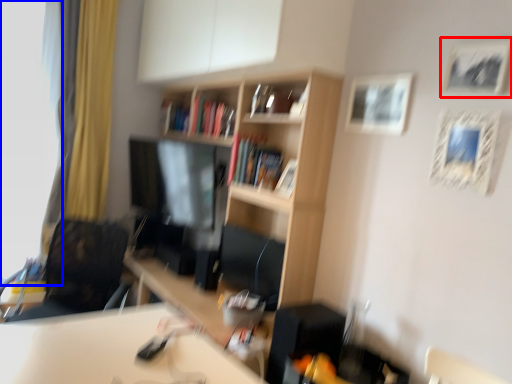
Question: Which of the following is the farthest to the observer, picture frame (highlighted by a red box) or window screen (highlighted by a blue box)?

Choices:
 (A) picture frame
 (B) window screen

Answer: (B)